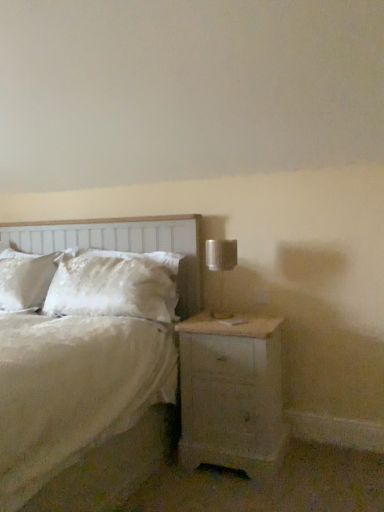
Question: From the image's perspective, is white wood headboard at left located above or below metallic silver table lamp at right?

Choices:
 (A) above
 (B) below

Answer: (B)

Question: In terms of size, does white wood headboard at left appear bigger or smaller than metallic silver table lamp at right?

Choices:
 (A) big
 (B) small

Answer: (A)

Question: Considering the real-world distances, which object is closest to the white fluffy pillow at center?

Choices:
 (A) white satin bed at center
 (B) metallic silver table lamp at right
 (C) white painted wood nightstand at lower right
 (D) white wood headboard at left

Answer: (D)

Question: Which object is positioned closest to the metallic silver table lamp at right?

Choices:
 (A) white satin bed at center
 (B) white wood headboard at left
 (C) white painted wood nightstand at lower right
 (D) white fluffy pillow at center

Answer: (C)